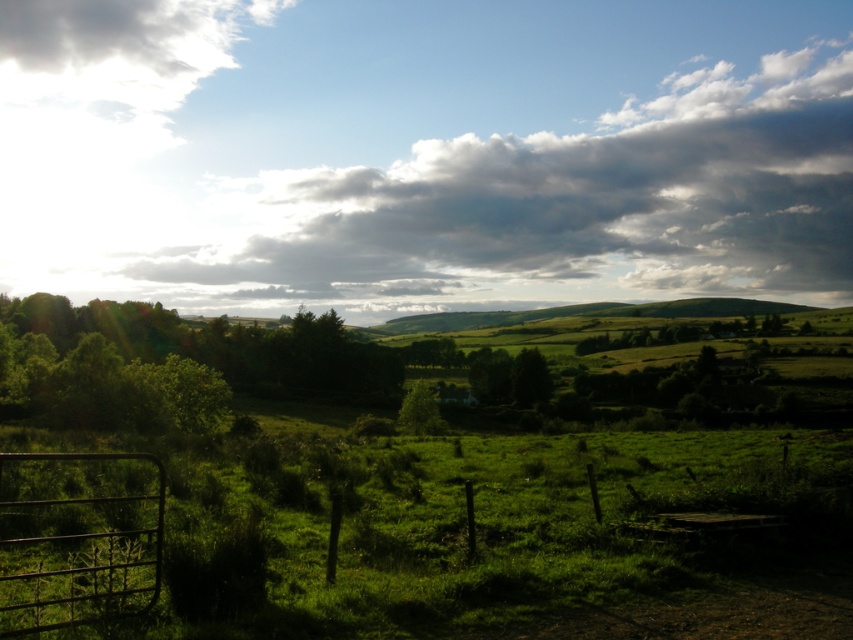
Question: Can you confirm if rusty metal gate at lower left is wider than green leafy tree at center?

Choices:
 (A) no
 (B) yes

Answer: (B)

Question: Among these points, which one is farthest from the camera?

Choices:
 (A) (717, 208)
 (B) (42, 458)

Answer: (A)

Question: Which point is farther from the camera taking this photo?

Choices:
 (A) (62, 586)
 (B) (427, 412)

Answer: (B)

Question: Is white fluffy cloud at upper center to the right of green leafy tree at center from the viewer's perspective?

Choices:
 (A) no
 (B) yes

Answer: (B)

Question: Is white fluffy cloud at upper center thinner than rusty metal gate at lower left?

Choices:
 (A) yes
 (B) no

Answer: (B)

Question: Considering the real-world distances, which object is closest to the rusty metal gate at lower left?

Choices:
 (A) green leafy tree at center
 (B) white fluffy cloud at upper center

Answer: (A)